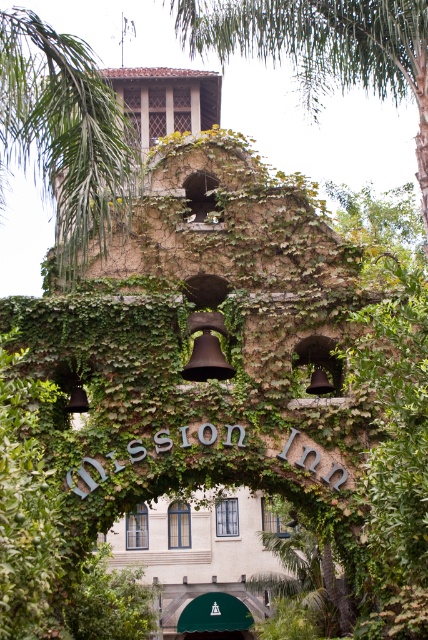
Can you confirm if green leafy palm tree at upper left is taller than green leafy palm tree at upper center?

No.

This screenshot has height=640, width=428. Find the location of `green leafy palm tree at upper left`. green leafy palm tree at upper left is located at coordinates (64, 131).

Is point (55, 145) positioned before point (327, 40)?

Yes, point (55, 145) is in front of point (327, 40).

Identify the location of green leafy palm tree at upper left. The image size is (428, 640). (64, 131).